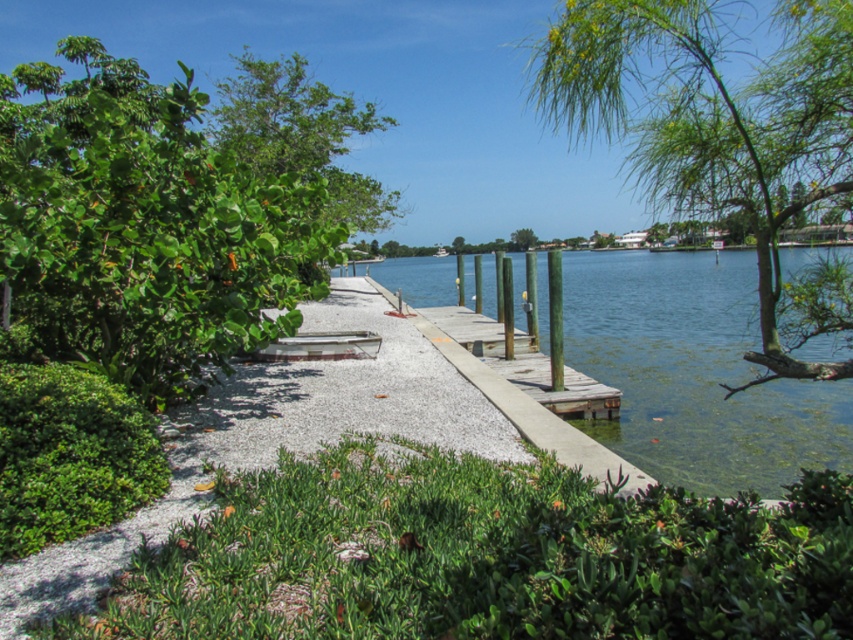
Does green leafy tree at left have a greater width compared to green leafy tree at upper left?

Result: No.

Does point (172, 84) lie behind point (239, 125)?

No.

Locate an element on the screen. This screenshot has width=853, height=640. green leafy tree at left is located at coordinates (170, 211).

Can you confirm if green leafy tree at upper right is thinner than green leafy tree at upper left?

No.

Does green leafy tree at upper right have a larger size compared to green leafy tree at upper left?

Yes.

Locate an element on the screen. This screenshot has height=640, width=853. green leafy tree at upper right is located at coordinates (712, 120).

Locate an element on the screen. The width and height of the screenshot is (853, 640). green leafy tree at upper right is located at coordinates click(x=712, y=120).

Who is positioned more to the left, green leafy tree at upper left or green leafy tree at center?

green leafy tree at upper left

Is green leafy tree at upper left to the right of green leafy tree at center from the viewer's perspective?

In fact, green leafy tree at upper left is to the left of green leafy tree at center.

Where is `green leafy tree at upper left`? This screenshot has height=640, width=853. green leafy tree at upper left is located at coordinates (300, 132).